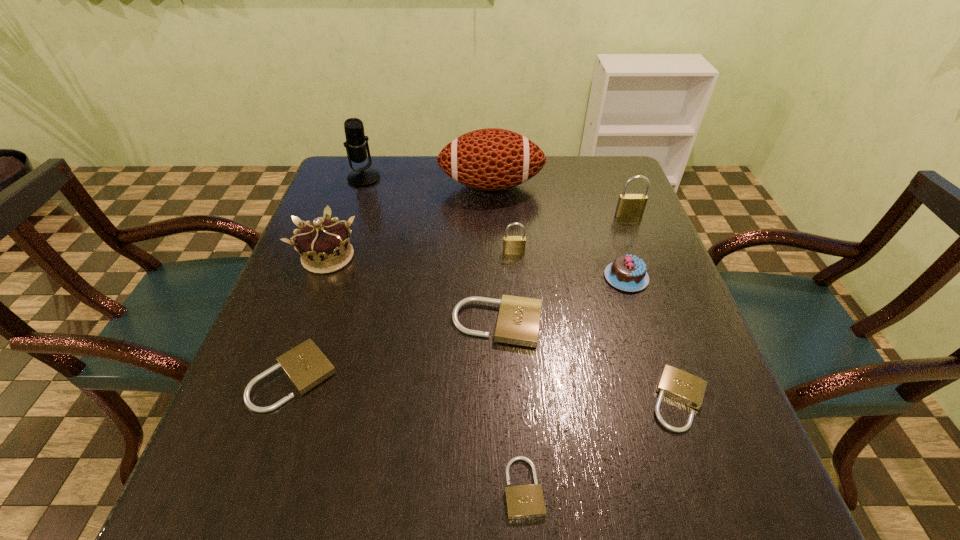
This screenshot has height=540, width=960. I want to click on blank region between the second biggest beige padlock and the left brass padlock, so click(404, 315).

Locate an element on the screen. object that is the second closest one to the fourth shortest object is located at coordinates (628, 273).

Select which object is the seventh closest to the smallest beige padlock. Please provide its 2D coordinates. Your answer should be formatted as a tuple, i.e. [(x, y)], where the tuple contains the x and y coordinates of a point satisfying the conditions above.

[(629, 205)]

You are a GUI agent. You are given a task and a screenshot of the screen. Output one action in this format:
    pyautogui.click(x=<x>, y=<y>)
    Task: Click on the padlock that is the fourth nearest to the eighth nearest object
    The height and width of the screenshot is (540, 960).
    Given the screenshot: What is the action you would take?
    coord(524,501)

The width and height of the screenshot is (960, 540). What are the coordinates of `padlock that can be found as the fifth closest to the rightmost beige padlock` in the screenshot? It's located at (306, 366).

Image resolution: width=960 pixels, height=540 pixels. In order to click on beige padlock that stands as the second closest to the fifth shortest object in this screenshot , I will do `click(681, 386)`.

Identify which beige padlock is the nearest to the pink chocolate cake. Please provide its 2D coordinates. Your answer should be formatted as a tuple, i.e. [(x, y)], where the tuple contains the x and y coordinates of a point satisfying the conditions above.

[(518, 321)]

Where is `vacant space that satisfies the following two spatial constraints: 1. on the front side of the nearest padlock; 2. on the left side of the football`? The width and height of the screenshot is (960, 540). vacant space that satisfies the following two spatial constraints: 1. on the front side of the nearest padlock; 2. on the left side of the football is located at coordinates (500, 487).

You are a GUI agent. You are given a task and a screenshot of the screen. Output one action in this format:
    pyautogui.click(x=<x>, y=<y>)
    Task: Click on the vacant region that satisfies the following two spatial constraints: 1. on the front-facing side of the second smallest beige padlock; 2. on the left side of the sixth shortest object
    This screenshot has width=960, height=540.
    Given the screenshot: What is the action you would take?
    pyautogui.click(x=526, y=400)